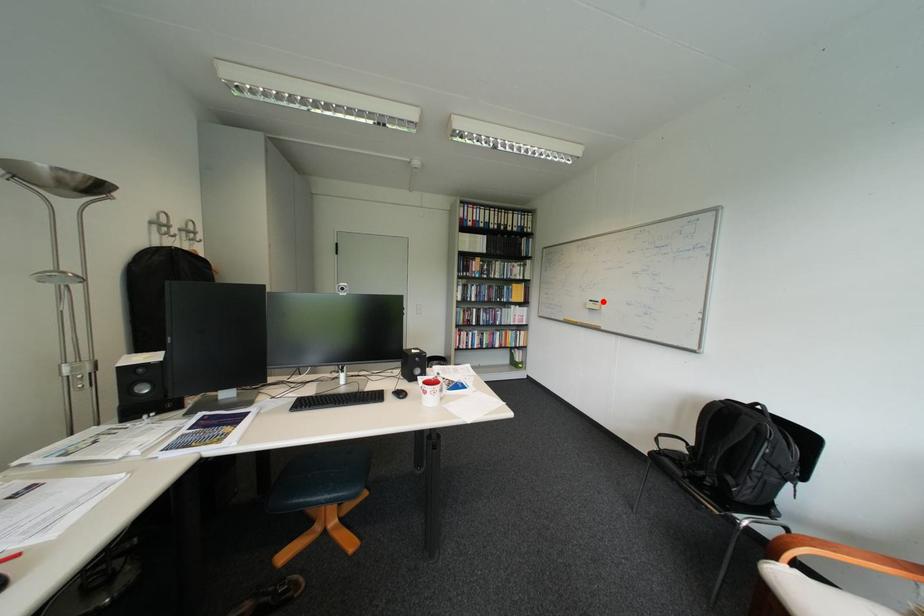
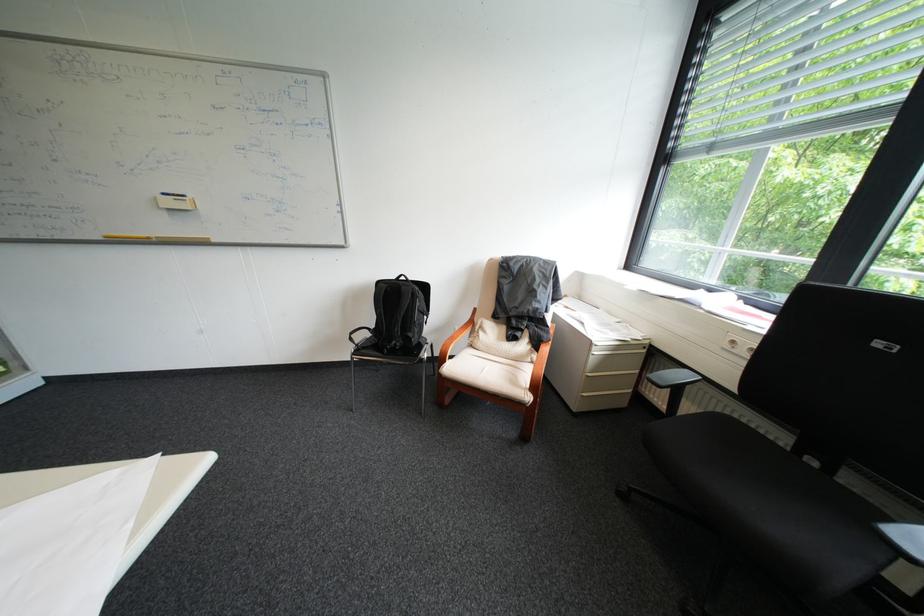
Find the pixel in the second image that matches the highlighted location in the first image.

(176, 195)